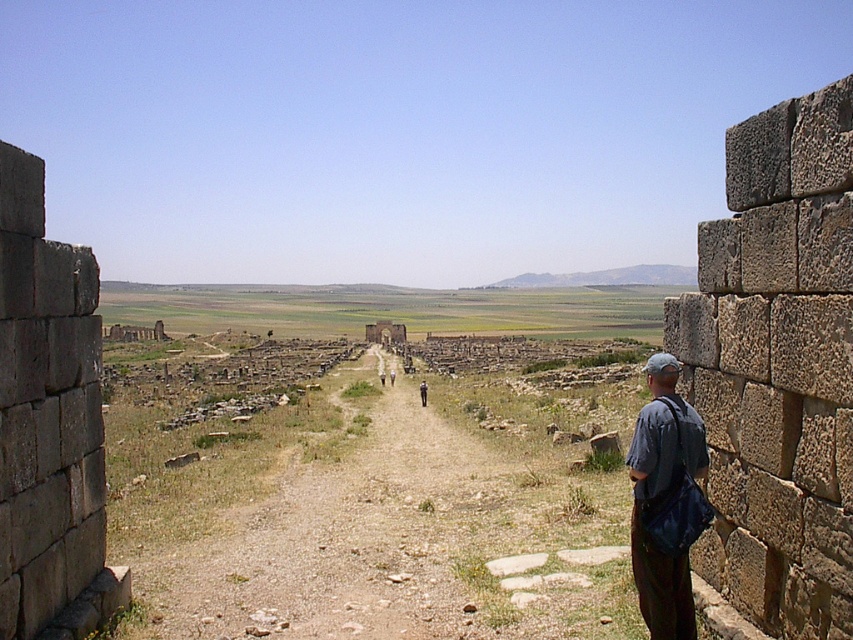
You are a tourist visiting the ancient ruins. You notice a stone wall at right and dark blue jeans at center. Which object is taller?

The stone wall at right is taller than the dark blue jeans at center.

You are standing at the center of the dirt path in the ancient ruins. You need to reach the stone wall at right to retrieve an artifact. Which direction should you walk to get there?

The stone wall at right is located at point 0.575 on the x and 0.912 on the y coordinate, so you should walk towards the right and slightly forward to reach it.